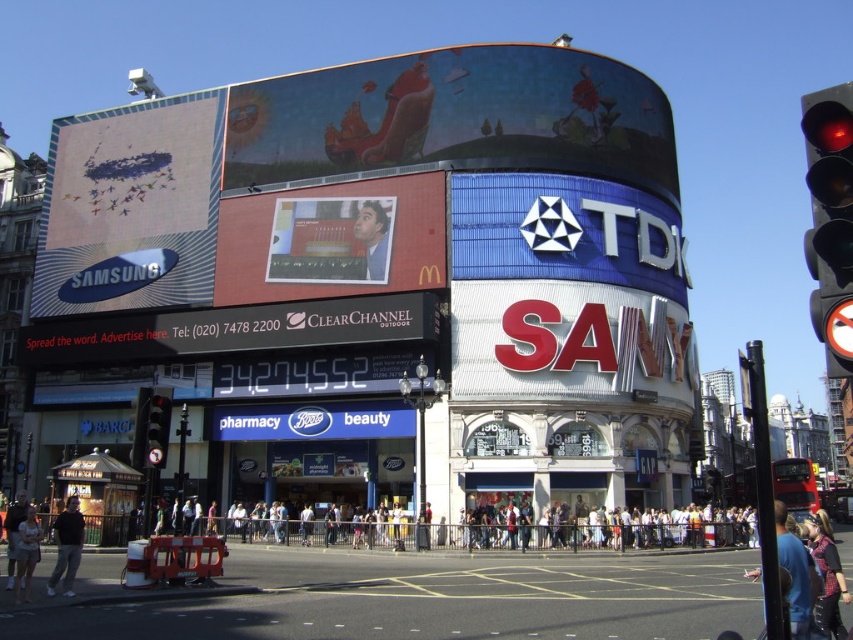
Between matte white samsung at upper left and red glass traffic light at left, which one has less height?

With less height is red glass traffic light at left.

Can you confirm if matte white samsung at upper left is shorter than red glass traffic light at left?

No, matte white samsung at upper left is not shorter than red glass traffic light at left.

I want to click on matte white samsung at upper left, so click(x=131, y=208).

Find the location of `matte white samsung at upper left`. matte white samsung at upper left is located at coordinates (131, 208).

Is point (316, 227) closer to viewer compared to point (299, 413)?

That is False.

Is point (357, 230) farther from viewer compared to point (343, 406)?

Yes, it is.

Image resolution: width=853 pixels, height=640 pixels. Find the location of `matte red billboard at center`. matte red billboard at center is located at coordinates coord(332,241).

Does blue glossy signboard at center appear under blue denim jeans at lower right?

No.

Who is more forward, (375, 428) or (781, 550)?

Point (781, 550) is in front.

You are a GUI agent. You are given a task and a screenshot of the screen. Output one action in this format:
    pyautogui.click(x=<x>, y=<y>)
    Task: Click on the blue glossy signboard at center
    This screenshot has height=640, width=853.
    Given the screenshot: What is the action you would take?
    pyautogui.click(x=312, y=420)